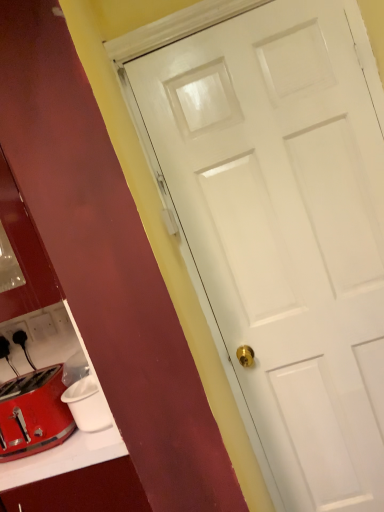
Question: Is white plastic electric outlet at lower left, which is the second electric outlet from left to right, bigger or smaller than shiny metallic toaster at lower left?

Choices:
 (A) small
 (B) big

Answer: (A)

Question: Looking at their shapes, would you say white plastic electric outlet at lower left, which is the second electric outlet from left to right, is wider or thinner than shiny metallic toaster at lower left?

Choices:
 (A) thin
 (B) wide

Answer: (A)

Question: Estimate the real-world distances between objects in this image. Which object is farther from the black plastic electric outlet at lower left, positioned as the 1th electric outlet in left-to-right order?

Choices:
 (A) shiny metallic toaster at lower left
 (B) white plastic electric outlet at lower left, which is the second electric outlet from left to right

Answer: (A)

Question: Which object is positioned farthest from the white plastic electric outlet at lower left, positioned as the first electric outlet in right-to-left order?

Choices:
 (A) shiny metallic toaster at lower left
 (B) black plastic electric outlet at lower left, arranged as the 2th electric outlet when viewed from the right

Answer: (A)